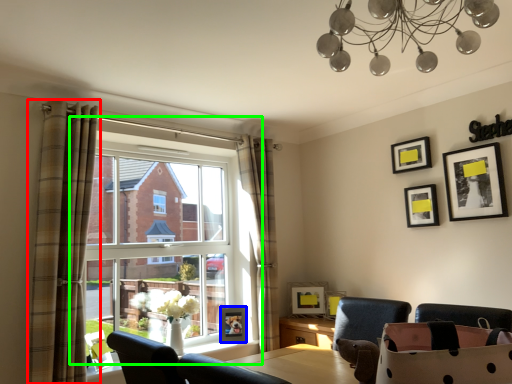
Question: Which object is positioned farthest from curtain (highlighted by a red box)? Select from picture frame (highlighted by a blue box) and window (highlighted by a green box).

Choices:
 (A) picture frame
 (B) window

Answer: (A)